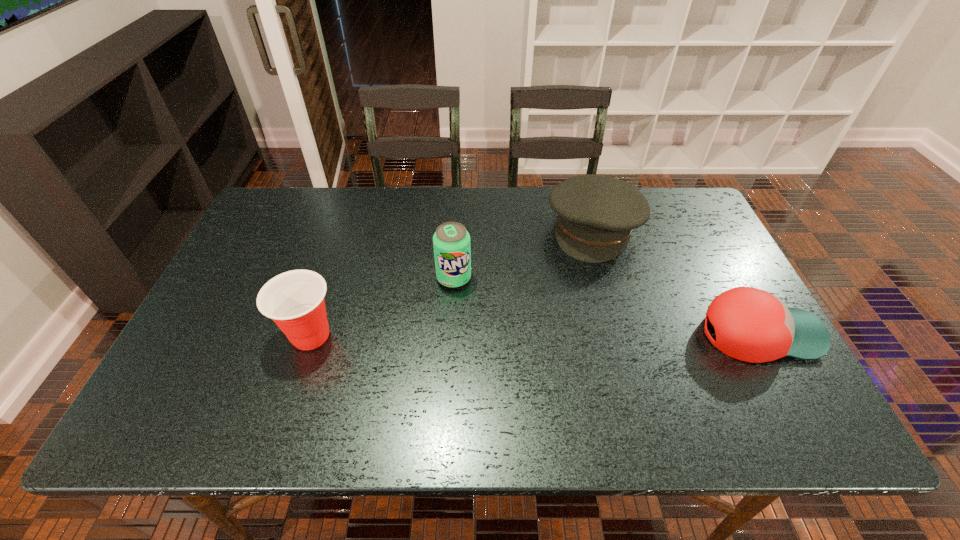
This screenshot has height=540, width=960. Identify the location of vacant space located 0.080m on the front-facing side of the pop soda. (469, 312).

Find the location of a particular element. This screenshot has height=540, width=960. blank area located on the front-facing side of the beret is located at coordinates (552, 368).

Where is `vacant space located 0.340m on the front-facing side of the beret`? This screenshot has height=540, width=960. vacant space located 0.340m on the front-facing side of the beret is located at coordinates (556, 354).

The image size is (960, 540). Identify the location of free region located 0.260m on the front-facing side of the beret. (564, 329).

You are a GUI agent. You are given a task and a screenshot of the screen. Output one action in this format:
    pyautogui.click(x=<x>, y=<y>)
    Task: Click on the object at the far edge
    This screenshot has height=540, width=960.
    Given the screenshot: What is the action you would take?
    pyautogui.click(x=596, y=214)

This screenshot has width=960, height=540. Identify the location of cup present at the near edge. (294, 300).

The height and width of the screenshot is (540, 960). In order to click on baseball cap located in the near edge section of the desktop in this screenshot , I will do `click(752, 325)`.

Find the location of a particular element. The image size is (960, 540). object positioned at the right edge is located at coordinates point(752,325).

This screenshot has height=540, width=960. I want to click on object present at the near right corner, so click(752, 325).

Image resolution: width=960 pixels, height=540 pixels. In the image, there is a desktop. What are the coordinates of `blank space at the far edge` in the screenshot? It's located at (518, 187).